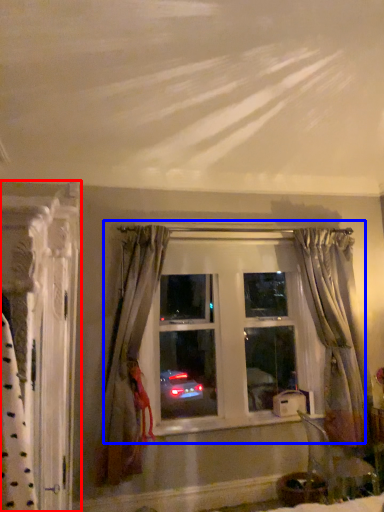
Question: Among these objects, which one is farthest to the camera, curtain (highlighted by a red box) or window (highlighted by a blue box)?

Choices:
 (A) curtain
 (B) window

Answer: (B)